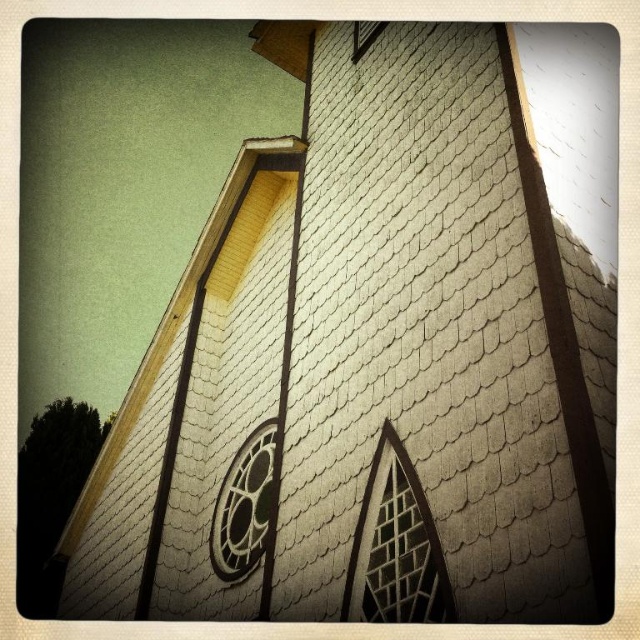
You are an architect analyzing the building exterior. You need to determine the position of the translucent glass window at center relative to the other windows. Based on the coordinates provided, can you identify its exact location on the wall?

The translucent glass window at center is located at point [396,547] on the wall.

You are standing in front of the building and want to know if the distance between the black glass window at center and the clear glass window at upper center is more than 70 feet. Based on the description, can you confirm this?

The black glass window at center is 70.01 feet away from the clear glass window at upper center, so yes, the distance between them is more than 70 feet.